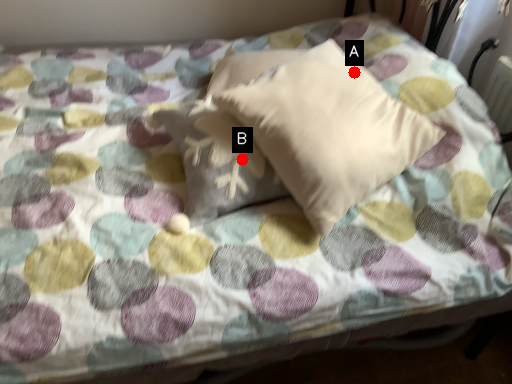
Question: Two points are circled on the image, labeled by A and B beside each circle. Which of the following is the closest to the observer?

Choices:
 (A) A is closer
 (B) B is closer

Answer: (B)